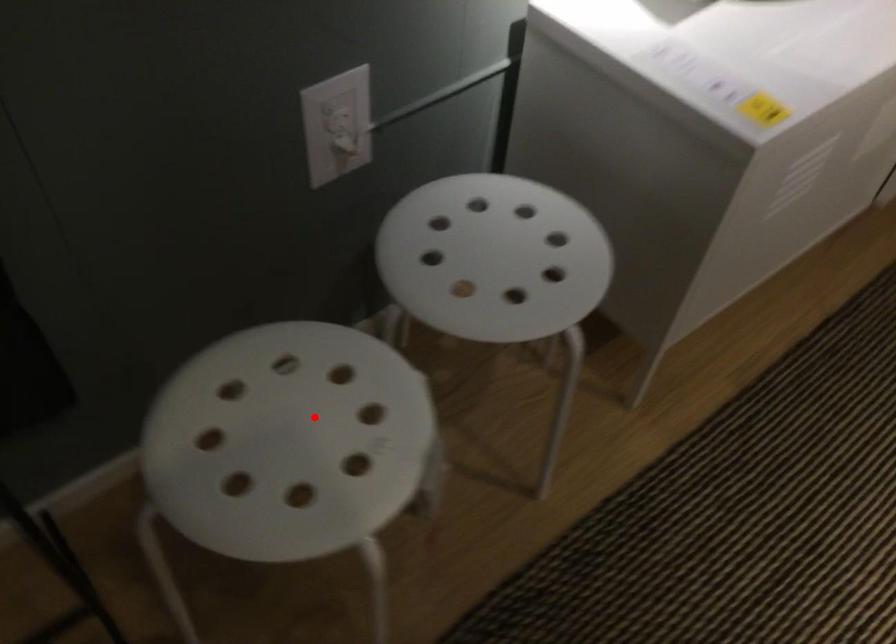
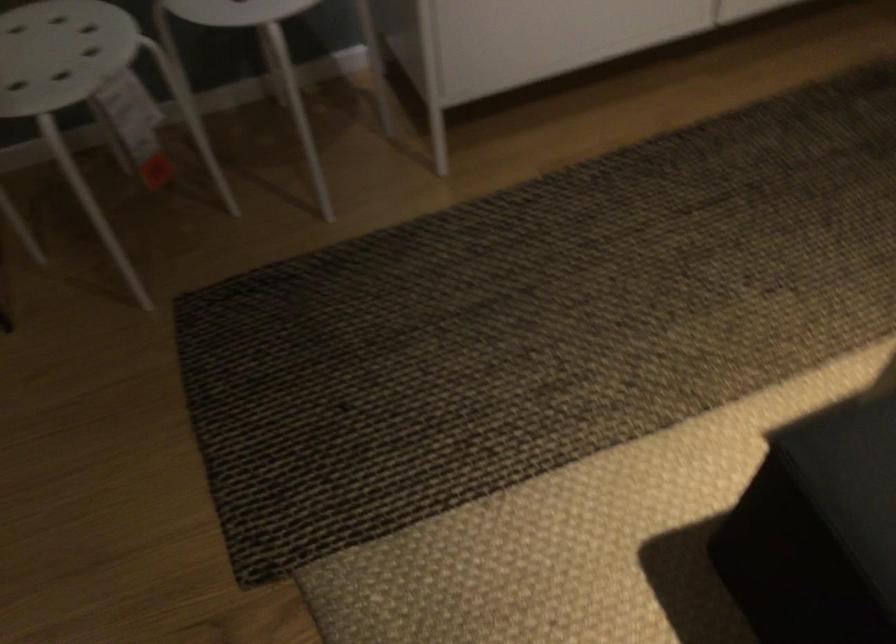
Question: I am providing you with two images of the same scene from different viewpoints. Image1 has a red point marked. In image2, the corresponding 3D location appears at what relative position? Reply with the corresponding letter.

Choices:
 (A) Closer
 (B) Farther

Answer: (B)